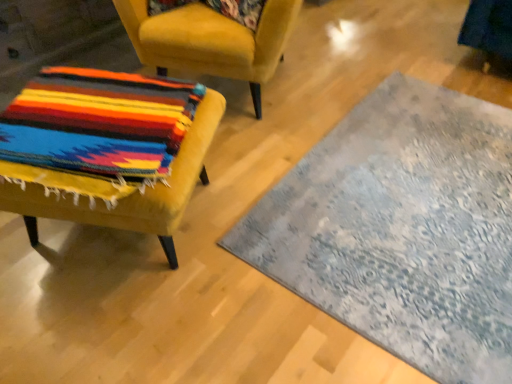
Image resolution: width=512 pixels, height=384 pixels. I want to click on empty space that is to the right of multicolored woven fabric at left, the 2th chair positioned from the bottom, so 362,58.